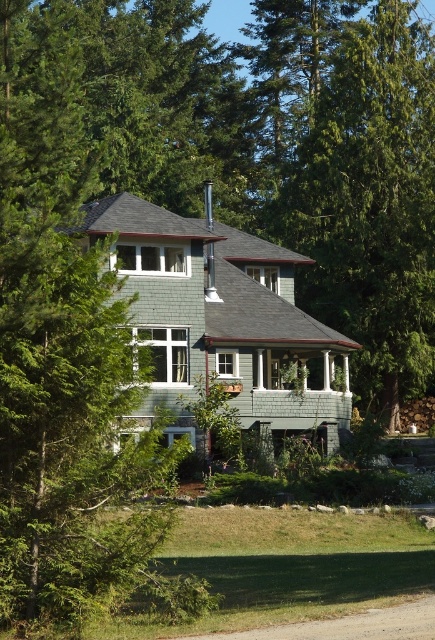
Which is more to the right, green leafy tree at left or green textured tree at center?

From the viewer's perspective, green textured tree at center appears more on the right side.

Who is taller, green leafy tree at left or green textured tree at center?

green textured tree at center is taller.

Does point (83, 481) lie in front of point (381, 243)?

That is True.

Locate an element on the screen. This screenshot has height=640, width=435. green leafy tree at left is located at coordinates (64, 324).